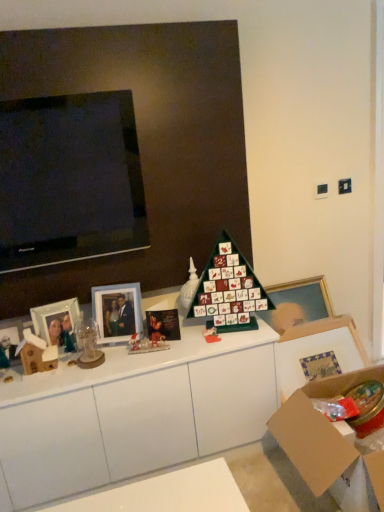
Find the location of a particular element. vacant space in front of glossy paper christmas card at center is located at coordinates (165, 351).